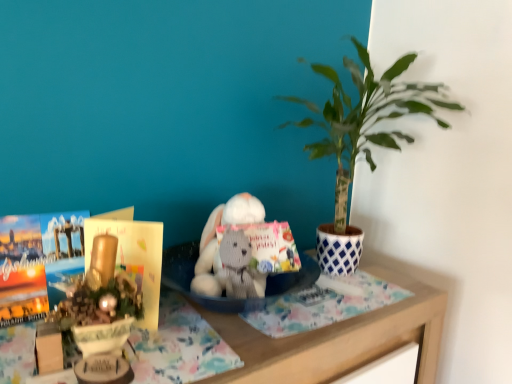
Question: Visually, is gray knitted stuffed animal at center positioned to the left or to the right of wooden table at center?

Choices:
 (A) right
 (B) left

Answer: (B)

Question: Considering the positions of gray knitted stuffed animal at center and wooden table at center in the image, is gray knitted stuffed animal at center wider or thinner than wooden table at center?

Choices:
 (A) thin
 (B) wide

Answer: (A)

Question: Estimate the real-world distances between objects in this image. Which object is farther from the green leafy plant at upper right?

Choices:
 (A) wooden table at center
 (B) matte paper book at left
 (C) gray knitted stuffed animal at center
 (D) fluffy white cloth at center

Answer: (B)

Question: Which object is positioned farthest from the matte paper book at left?

Choices:
 (A) green leafy plant at upper right
 (B) wooden table at center
 (C) gray knitted stuffed animal at center
 (D) fluffy white cloth at center

Answer: (A)